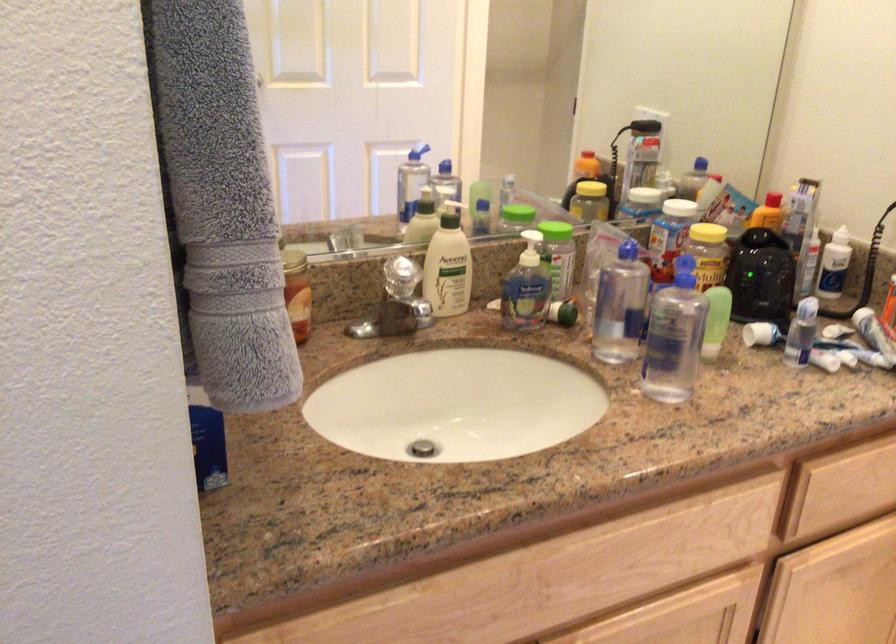
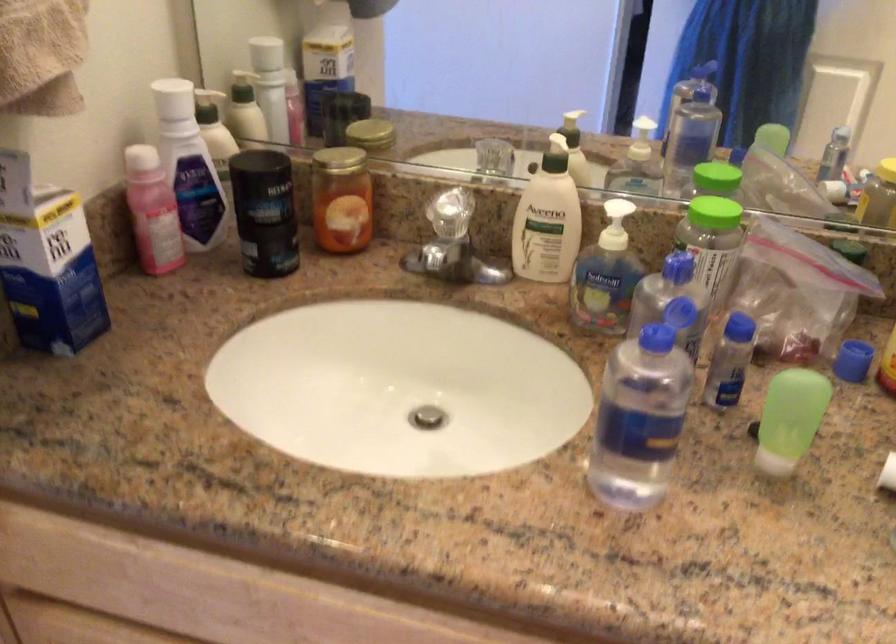
In the second image, find the point that corresponds to (530,210) in the first image.

(716, 178)